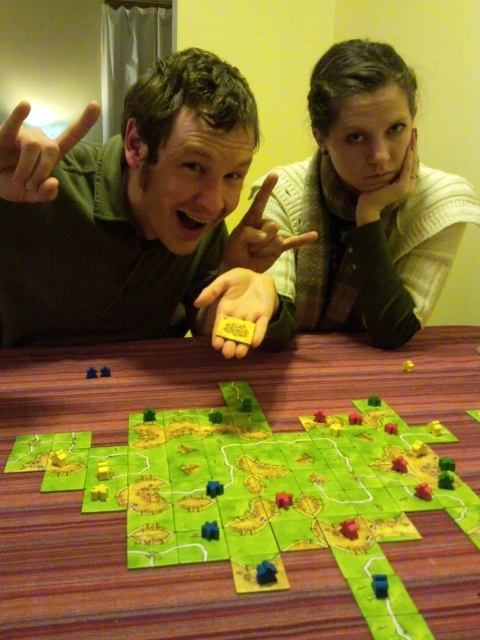
Is matte yellow token at center above green paper map at center?

Correct, matte yellow token at center is located above green paper map at center.

Based on the photo, who is more distant from viewer, (44,250) or (154,394)?

Point (44,250)

Who is more distant from viewer, (240,154) or (430,525)?

The point (240,154) is behind.

Find the location of `matte yellow token at center`. matte yellow token at center is located at coordinates (228, 212).